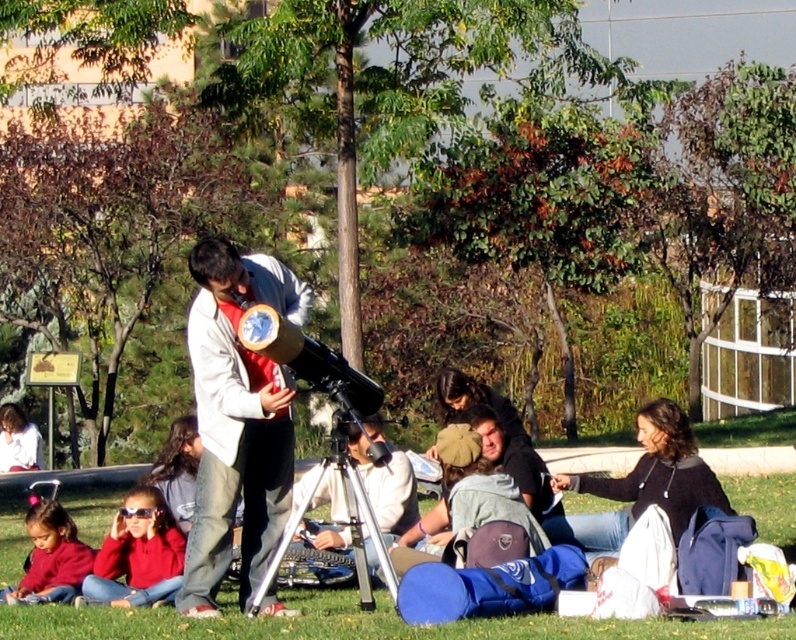
Question: Is matte red jacket at lower left closer to camera compared to matte red sweater at lower left?

Choices:
 (A) no
 (B) yes

Answer: (B)

Question: Is matte white jacket at center wider than matte white telescope at center?

Choices:
 (A) no
 (B) yes

Answer: (B)

Question: Is green grass at center behind matte red jacket at lower left?

Choices:
 (A) yes
 (B) no

Answer: (B)

Question: Which object appears closest to the camera in this image?

Choices:
 (A) green grass at center
 (B) matte white jacket at center
 (C) matte red sweater at lower left
 (D) matte red jacket at lower left

Answer: (A)

Question: Considering the real-world distances, which object is farthest from the matte white telescope at center?

Choices:
 (A) matte white jacket at center
 (B) green grass at center
 (C) matte red jacket at lower left
 (D) matte red sweater at lower left

Answer: (B)

Question: Which of these objects is positioned closest to the matte white jacket at center?

Choices:
 (A) matte red jacket at lower left
 (B) matte white telescope at center
 (C) matte red sweater at lower left
 (D) green grass at center

Answer: (A)